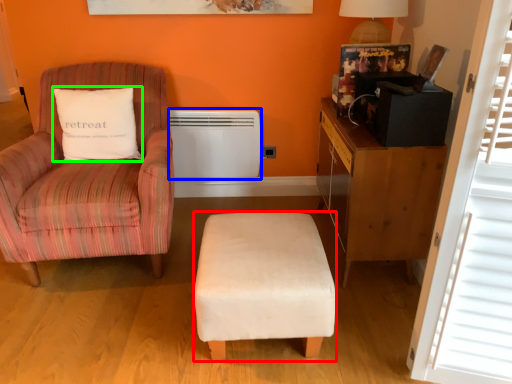
Question: Considering the real-world distances, which object is closest to stool (highlighted by a red box)? heater (highlighted by a blue box) or pillow (highlighted by a green box).

Choices:
 (A) heater
 (B) pillow

Answer: (B)